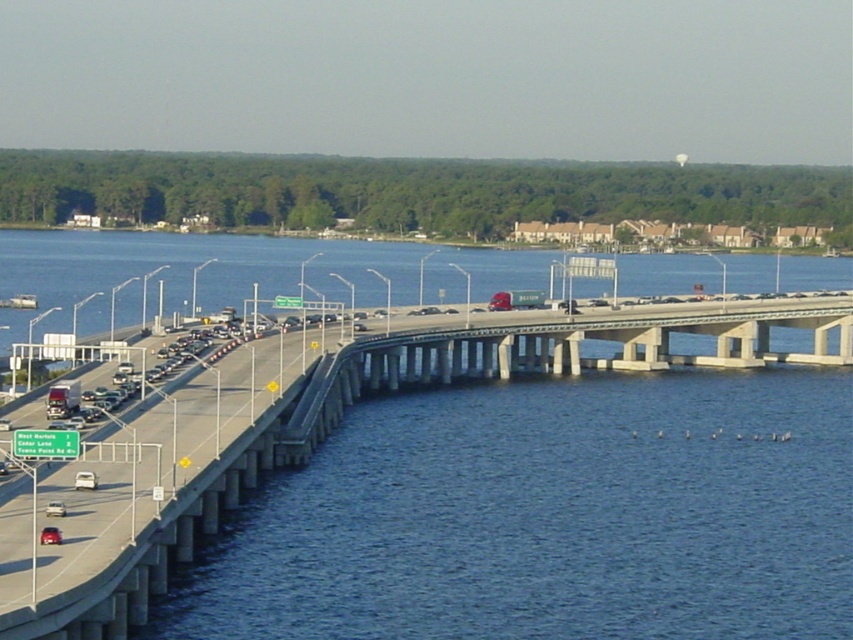
Question: Does silver metallic sedan at center appear on the right side of silver metallic sedan at lower left?

Choices:
 (A) yes
 (B) no

Answer: (B)

Question: Which point appears farthest from the camera in this image?

Choices:
 (A) (50, 515)
 (B) (59, 532)

Answer: (A)

Question: Is concrete bridge at center to the right of silver metallic sedan at lower left from the viewer's perspective?

Choices:
 (A) no
 (B) yes

Answer: (B)

Question: Which object is positioned farthest from the silver metallic sedan at lower left?

Choices:
 (A) shiny red car at lower left
 (B) silver metallic sedan at center

Answer: (B)

Question: Which point is farther from the camera taking this photo?

Choices:
 (A) (91, 477)
 (B) (51, 506)

Answer: (A)

Question: Observing the image, what is the correct spatial positioning of silver metallic sedan at center in reference to silver metallic sedan at lower left?

Choices:
 (A) left
 (B) right

Answer: (A)